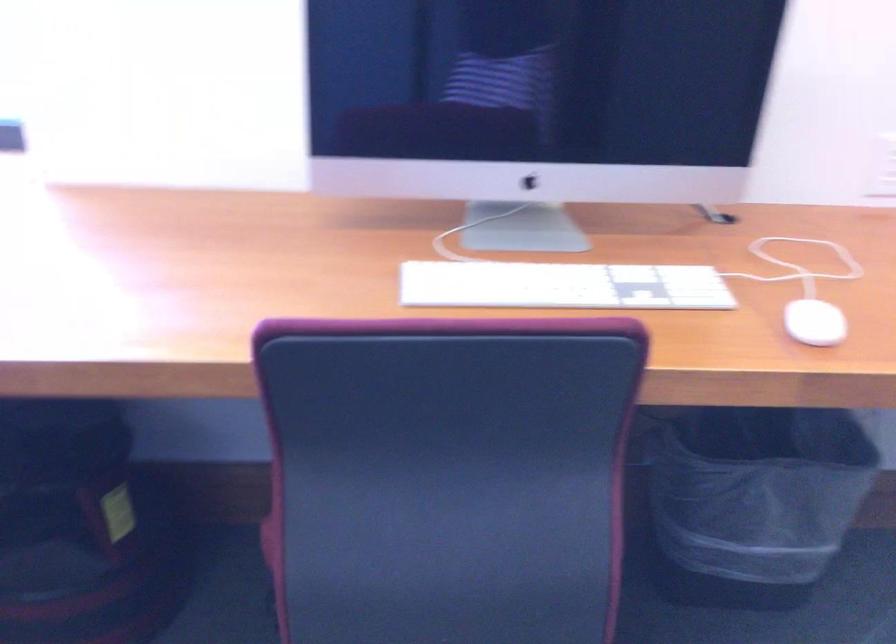
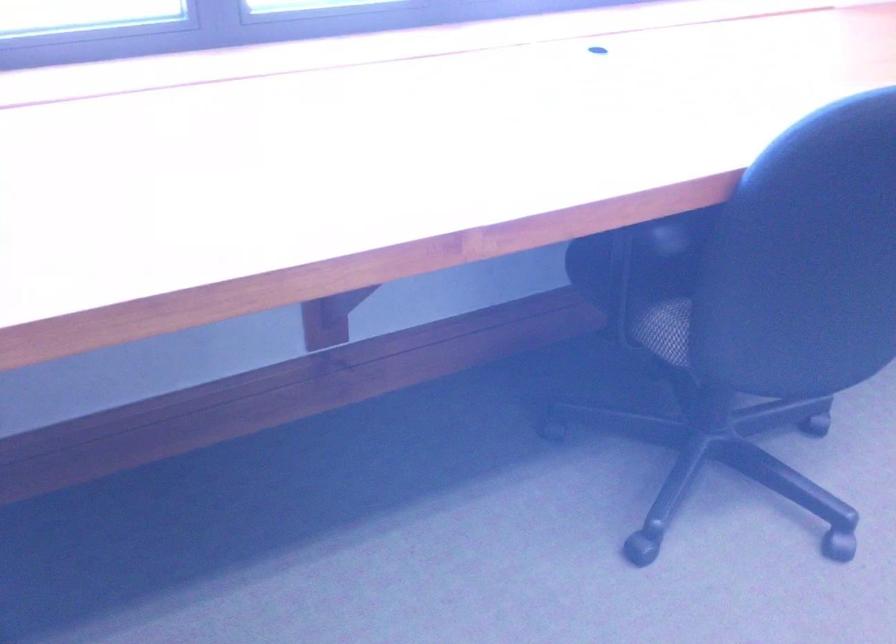
Question: Which direction would the cameraman need to move to produce the second image? Reply with the corresponding letter.

Choices:
 (A) Left
 (B) Right
 (C) Forward
 (D) Backward

Answer: (A)